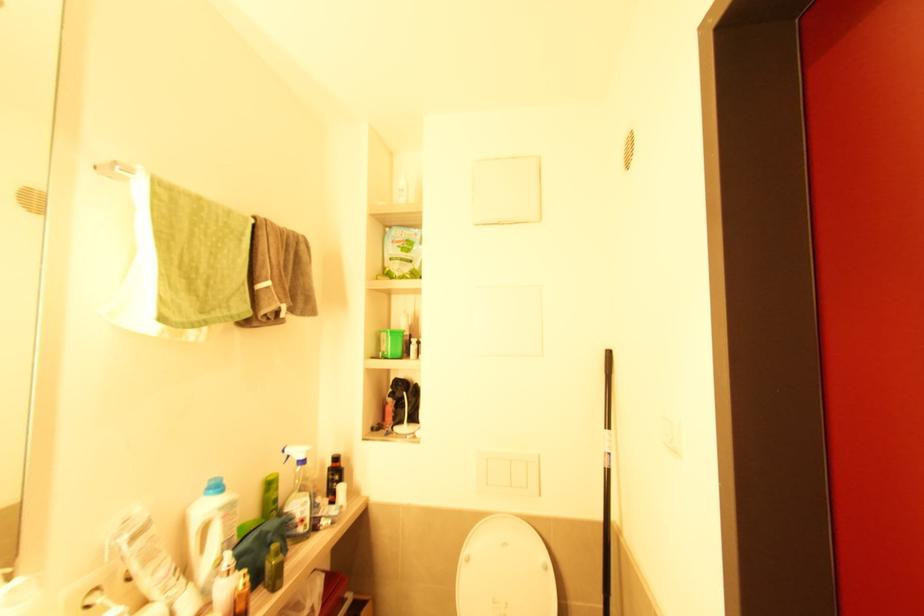
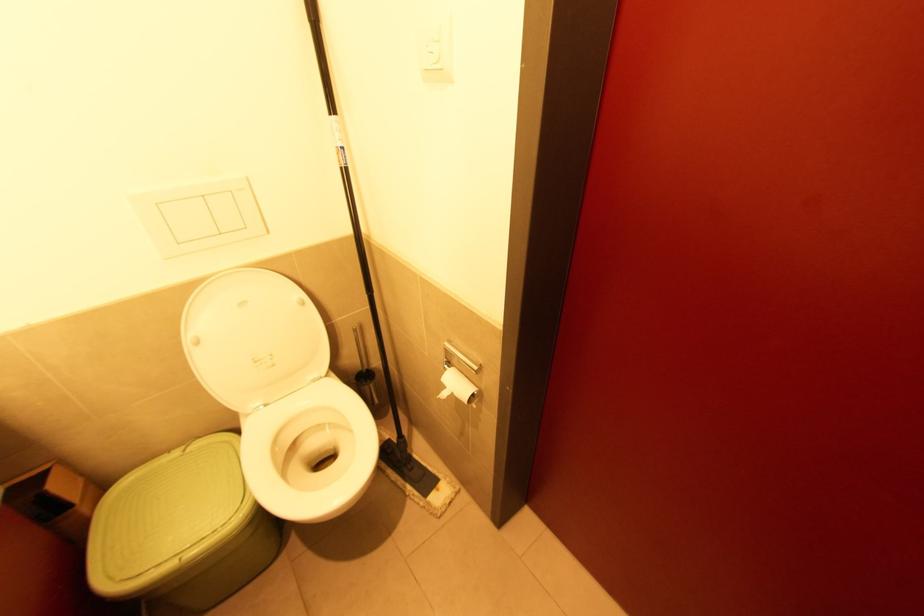
Where in the second image is the point corresponding to (469,561) from the first image?

(200, 342)